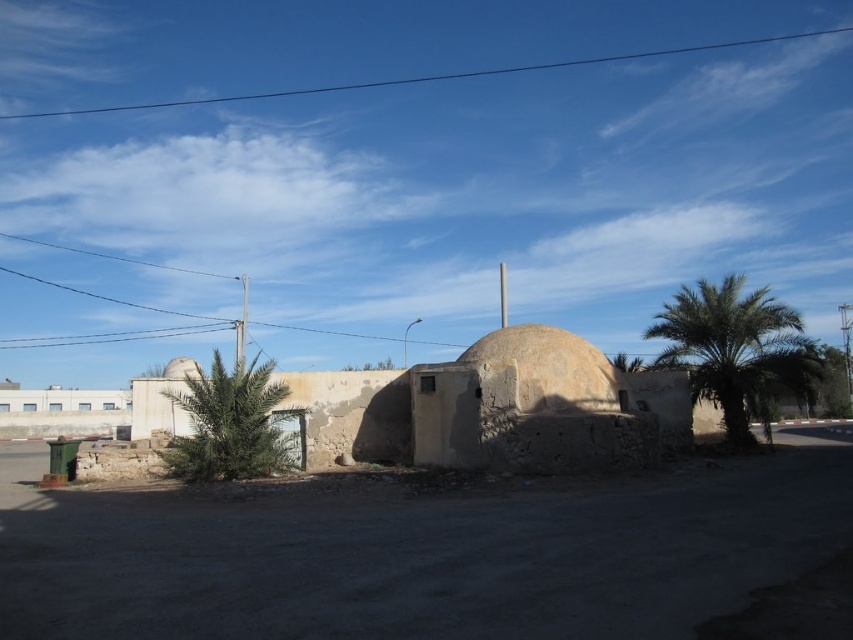
You are a traveler standing on the dirt road in the foreground. You see a green leafy palm at right and a smooth beige dome at center. Which structure is taller?

The green leafy palm at right is taller than the smooth beige dome at center.

You are standing on the dirt road and want to take a photo of both the green leafy palm tree at center and the gray stone dome at center. Which object should you focus on first to ensure both are in clear view?

You should focus on the green leafy palm tree at center first because it is closer to you than the gray stone dome at center. By focusing on the closer object, both will be in focus if they are within the camera depth of field.